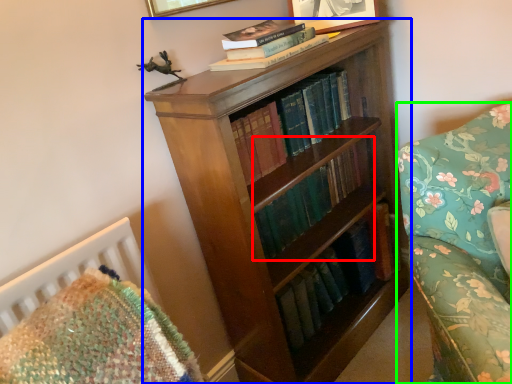
Question: Which is nearer to the book (highlighted by a red box)? bookcase (highlighted by a blue box) or studio couch (highlighted by a green box).

Choices:
 (A) bookcase
 (B) studio couch

Answer: (A)